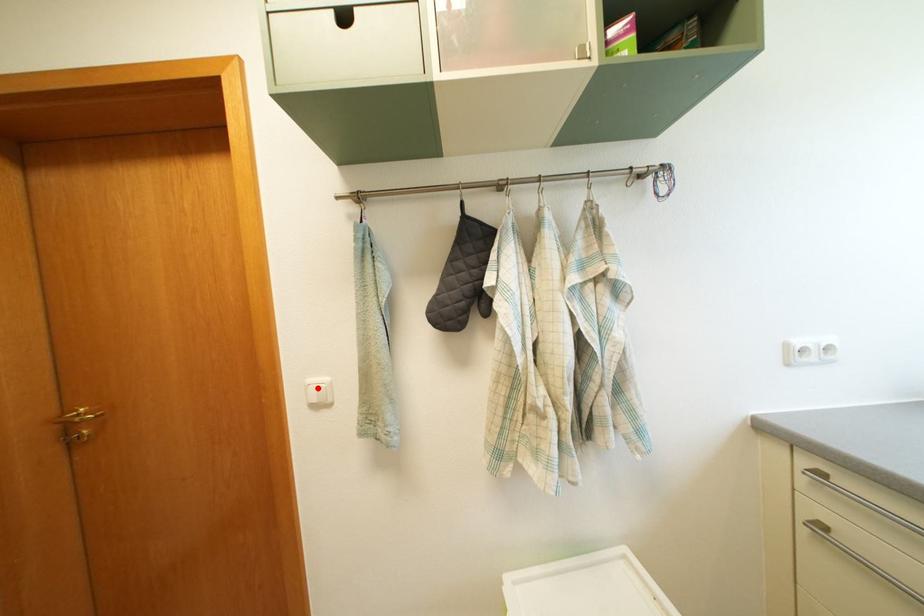
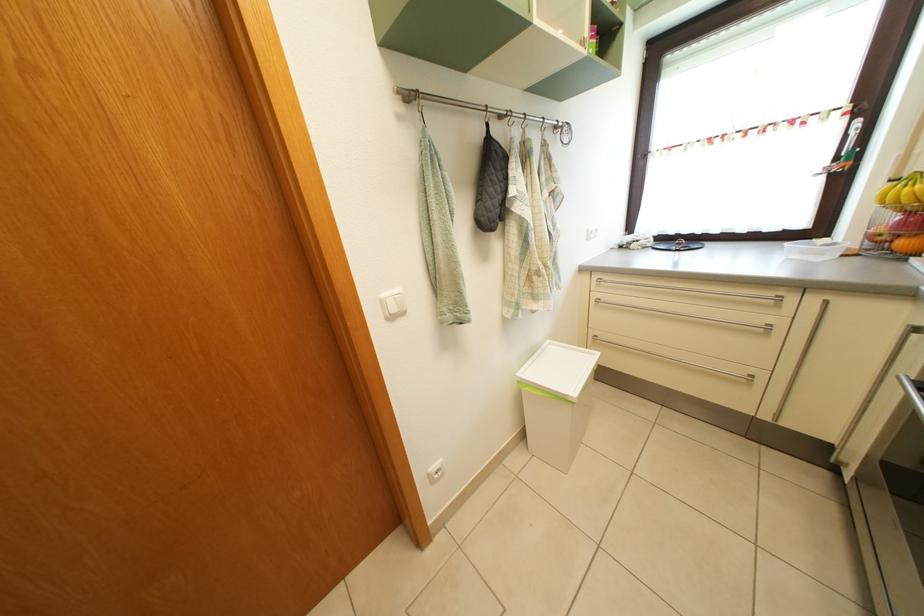
Question: I am providing you with two images of the same scene from different viewpoints. Given a red point in image1, look at the same physical point in image2. Is it:

Choices:
 (A) Closer to the viewpoint
 (B) Farther from the viewpoint

Answer: (A)